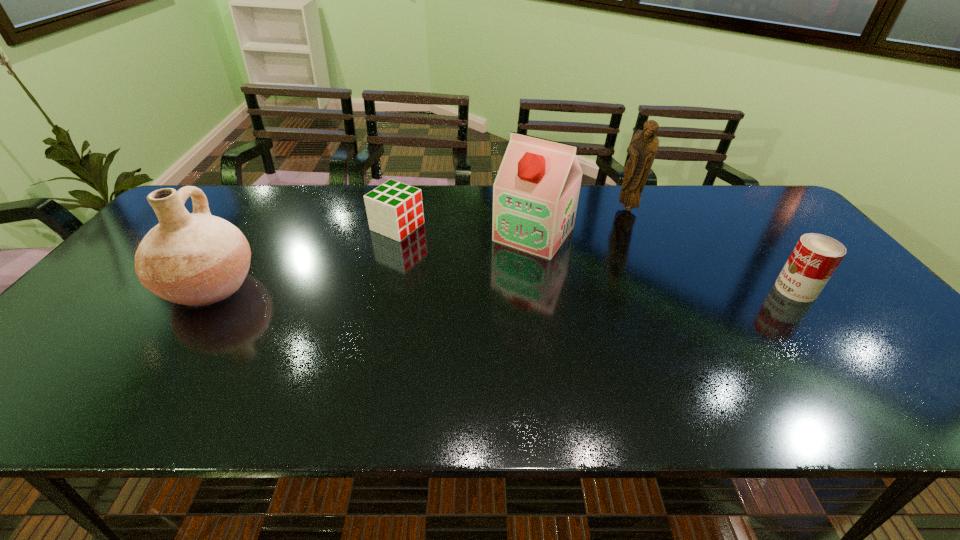
Find the location of a particular element. The image size is (960, 540). cube at the far edge is located at coordinates (394, 209).

You are a GUI agent. You are given a task and a screenshot of the screen. Output one action in this format:
    pyautogui.click(x=<x>, y=<y>)
    Task: Click on the soya milk that is positioned at the far edge
    The image size is (960, 540).
    Given the screenshot: What is the action you would take?
    pyautogui.click(x=535, y=194)

Find the location of a particular element. figurine located at the far edge is located at coordinates (643, 147).

Image resolution: width=960 pixels, height=540 pixels. In order to click on object at the left edge in this screenshot , I will do `click(196, 259)`.

Locate an element on the screen. object that is at the right edge is located at coordinates (815, 257).

Identify the location of vacant space at the far edge of the desktop. The height and width of the screenshot is (540, 960). click(x=328, y=222).

At what (x,y) coordinates should I click in order to perform the action: click on vacant position at the near edge of the desktop. Please return your answer as a coordinate pair (x, y). This screenshot has width=960, height=540. Looking at the image, I should click on (783, 373).

In the image, there is a desktop. Identify the location of free space at the left edge. Image resolution: width=960 pixels, height=540 pixels. (145, 305).

In the image, there is a desktop. Where is `free space at the right edge`? free space at the right edge is located at coordinates (774, 255).

At what (x,y) coordinates should I click in order to perform the action: click on vacant space at the far right corner of the desktop. Please return your answer as a coordinate pair (x, y). The width and height of the screenshot is (960, 540). Looking at the image, I should click on (765, 191).